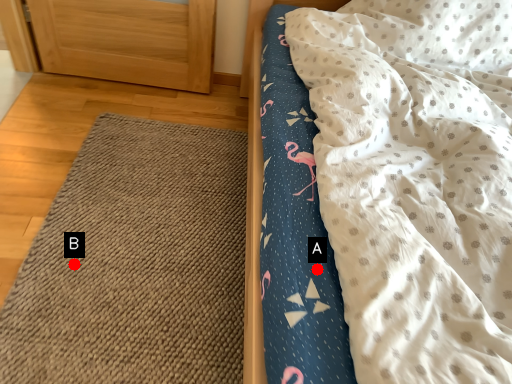
Question: Two points are circled on the image, labeled by A and B beside each circle. Which point is closer to the camera?

Choices:
 (A) A is closer
 (B) B is closer

Answer: (A)